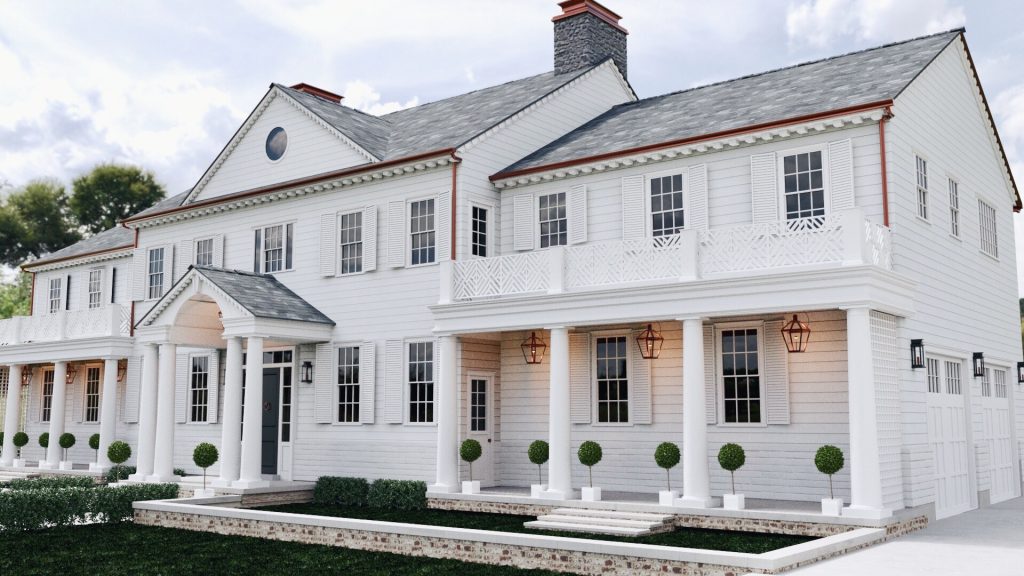
Where is `stone chimney`? stone chimney is located at coordinates (588, 41).